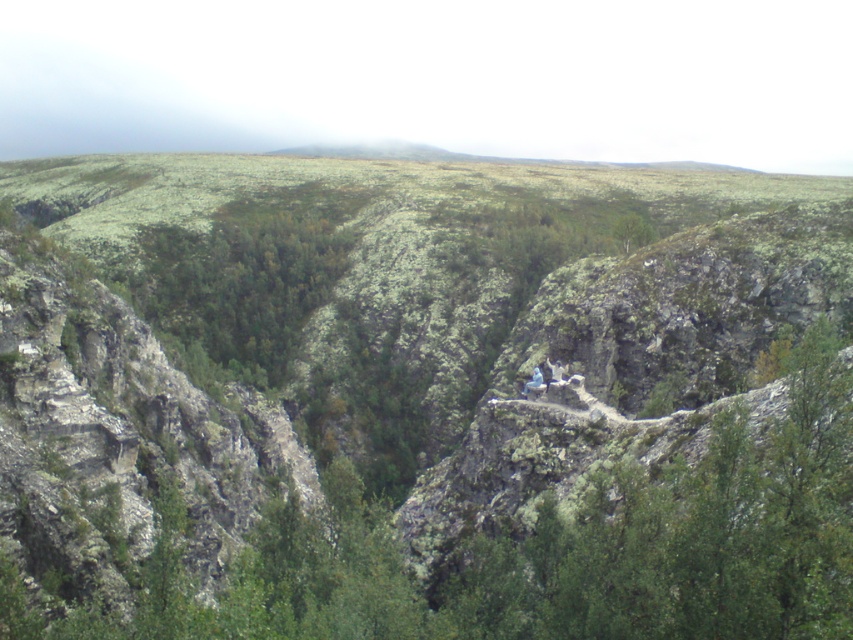
Can you confirm if green leafy tree at upper center is bigger than green mossy trees at center?

No, green leafy tree at upper center is not bigger than green mossy trees at center.

Is green leafy tree at upper center closer to camera compared to green mossy trees at center?

Yes, green leafy tree at upper center is closer to the viewer.

Locate an element on the screen. The image size is (853, 640). green leafy tree at upper center is located at coordinates (543, 548).

Is point (186, 348) positioned in front of point (543, 380)?

No, (186, 348) is behind (543, 380).

Between green mossy trees at center and blue fabric person at center, which one appears on the left side from the viewer's perspective?

green mossy trees at center

Image resolution: width=853 pixels, height=640 pixels. I want to click on green mossy trees at center, so click(x=242, y=280).

At what (x,y) coordinates should I click in order to perform the action: click on green mossy trees at center. Please return your answer as a coordinate pair (x, y). The width and height of the screenshot is (853, 640). Looking at the image, I should click on (242, 280).

Is green leafy tree at upper center to the right of blue fabric person at center from the viewer's perspective?

No, green leafy tree at upper center is not to the right of blue fabric person at center.

Can you confirm if green leafy tree at upper center is positioned to the left of blue fabric person at center?

Yes, green leafy tree at upper center is to the left of blue fabric person at center.

This screenshot has width=853, height=640. What are the coordinates of `green leafy tree at upper center` in the screenshot? It's located at (543, 548).